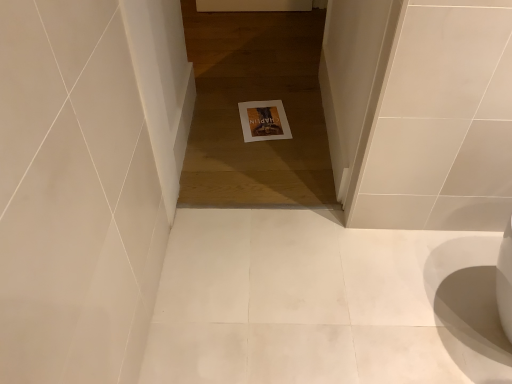
The image size is (512, 384). Find the location of `free area behind white paper at center`. free area behind white paper at center is located at coordinates (260, 87).